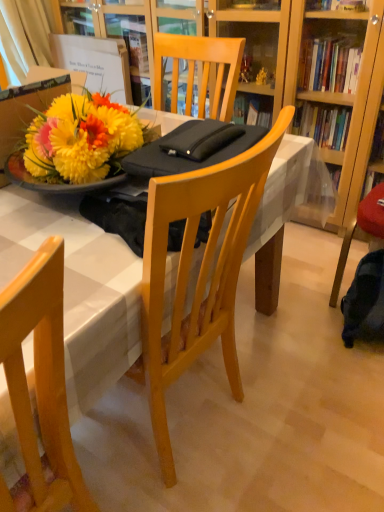
Question: Considering the relative positions of light wood chair at lower left and white glossy table at center in the image provided, is light wood chair at lower left in front of white glossy table at center?

Choices:
 (A) no
 (B) yes

Answer: (B)

Question: Does light wood chair at lower left have a greater height compared to white glossy table at center?

Choices:
 (A) no
 (B) yes

Answer: (A)

Question: Does light wood chair at lower left have a smaller size compared to white glossy table at center?

Choices:
 (A) no
 (B) yes

Answer: (B)

Question: Considering the relative positions of light wood chair at lower left and white glossy table at center in the image provided, is light wood chair at lower left to the right of white glossy table at center from the viewer's perspective?

Choices:
 (A) yes
 (B) no

Answer: (B)

Question: Is light wood chair at lower left surrounding white glossy table at center?

Choices:
 (A) yes
 (B) no

Answer: (B)

Question: In terms of size, does white fabric curtain at upper left appear bigger or smaller than light wood chair at lower left?

Choices:
 (A) big
 (B) small

Answer: (B)

Question: Is white fabric curtain at upper left spatially inside light wood chair at lower left, or outside of it?

Choices:
 (A) inside
 (B) outside

Answer: (B)

Question: Considering the positions of white fabric curtain at upper left and light wood chair at lower left in the image, is white fabric curtain at upper left wider or thinner than light wood chair at lower left?

Choices:
 (A) thin
 (B) wide

Answer: (A)

Question: Visually, is white fabric curtain at upper left positioned to the left or to the right of light wood chair at lower left?

Choices:
 (A) left
 (B) right

Answer: (A)

Question: Is light wood chair at lower left taller or shorter than white fabric curtain at upper left?

Choices:
 (A) tall
 (B) short

Answer: (A)

Question: Is point (61, 320) closer or farther from the camera than point (11, 41)?

Choices:
 (A) closer
 (B) farther

Answer: (A)

Question: Considering their positions, is light wood chair at lower left located in front of or behind white fabric curtain at upper left?

Choices:
 (A) behind
 (B) front

Answer: (B)

Question: Visually, is light wood chair at lower left positioned to the left or to the right of white fabric curtain at upper left?

Choices:
 (A) left
 (B) right

Answer: (B)

Question: In the image, is white glossy table at center positioned in front of or behind light wood chair at lower left?

Choices:
 (A) behind
 (B) front

Answer: (A)

Question: From a real-world perspective, relative to light wood chair at lower left, is white glossy table at center vertically above or below?

Choices:
 (A) below
 (B) above

Answer: (A)